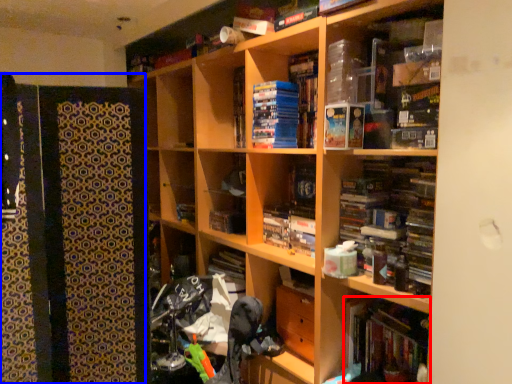
Question: Which of the following is the closest to the observer, book (highlighted by a red box) or cabinet (highlighted by a blue box)?

Choices:
 (A) book
 (B) cabinet

Answer: (B)